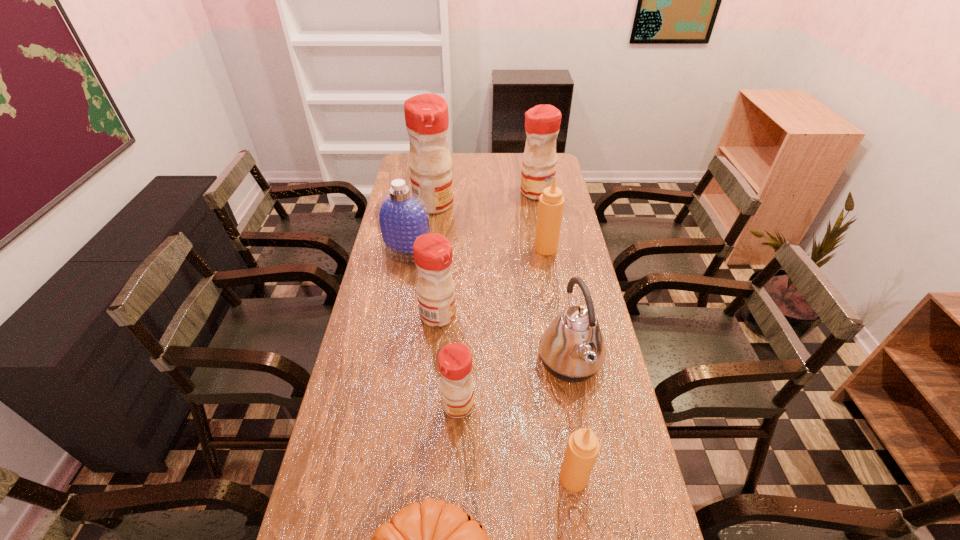
Locate an element on the screen. The height and width of the screenshot is (540, 960). free space between the rightmost red condiment and the third biggest red condiment is located at coordinates (488, 253).

The image size is (960, 540). What are the coordinates of `free area in between the kettle and the second nearest red condiment` in the screenshot? It's located at (504, 338).

The height and width of the screenshot is (540, 960). What are the coordinates of `empty location between the third biggest red condiment and the fifth shortest condiment` in the screenshot? It's located at (488, 253).

This screenshot has width=960, height=540. In order to click on free space between the rightmost red condiment and the second smallest red condiment in this screenshot , I will do `click(488, 253)`.

Identify the location of unoccupied position between the smaller tan condiment and the second nearest red condiment. This screenshot has height=540, width=960. (506, 396).

Locate an element on the screen. The image size is (960, 540). object that is the eighth closest to the fifth shortest condiment is located at coordinates (432, 539).

Choose which object is the fifth nearest neighbor to the third biggest red condiment. Please provide its 2D coordinates. Your answer should be formatted as a tuple, i.e. [(x, y)], where the tuple contains the x and y coordinates of a point satisfying the conditions above.

[(426, 115)]

Identify the location of condiment identified as the sixth closest to the cleansing agent. (583, 447).

The height and width of the screenshot is (540, 960). I want to click on condiment that is the fifth closest one to the biggest red condiment, so click(583, 447).

This screenshot has height=540, width=960. What are the coordinates of `red condiment that is the closest to the rightmost red condiment` in the screenshot? It's located at (426, 115).